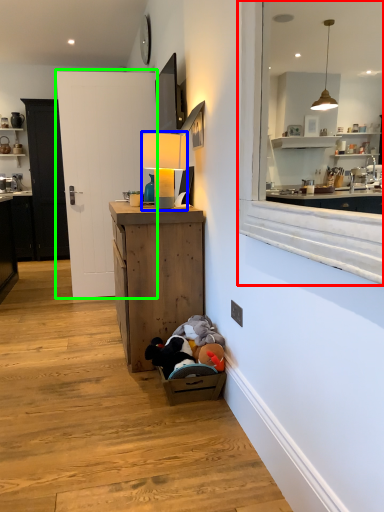
Question: Estimate the real-world distances between objects in this image. Which object is closer to window (highlighted by a red box), table lamp (highlighted by a blue box) or door (highlighted by a green box)?

Choices:
 (A) table lamp
 (B) door

Answer: (A)